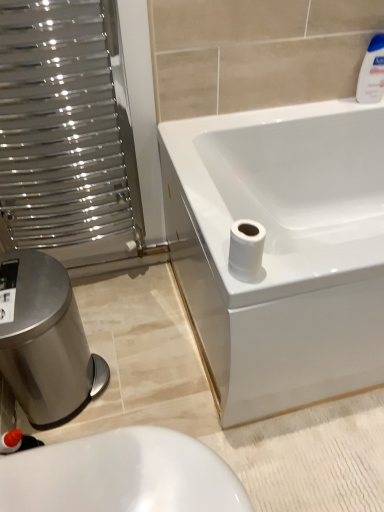
Question: Is white glossy toilet at lower left completely or partially inside white matte toilet paper at lower right?

Choices:
 (A) yes
 (B) no

Answer: (B)

Question: From a real-world perspective, is white matte toilet paper at lower right beneath white glossy toilet at lower left?

Choices:
 (A) no
 (B) yes

Answer: (A)

Question: From a real-world perspective, is white matte toilet paper at lower right located higher than white glossy toilet at lower left?

Choices:
 (A) yes
 (B) no

Answer: (A)

Question: Is white matte toilet paper at lower right wider than white glossy toilet at lower left?

Choices:
 (A) no
 (B) yes

Answer: (A)

Question: Considering the relative sizes of white matte toilet paper at lower right and white glossy toilet at lower left in the image provided, is white matte toilet paper at lower right thinner than white glossy toilet at lower left?

Choices:
 (A) yes
 (B) no

Answer: (A)

Question: Is white matte toilet paper at lower right positioned behind white glossy toilet at lower left?

Choices:
 (A) no
 (B) yes

Answer: (B)

Question: Does white glossy toilet at lower left have a smaller size compared to brushed metal bidet at lower left?

Choices:
 (A) yes
 (B) no

Answer: (A)

Question: From the image's perspective, is white glossy toilet at lower left located above brushed metal bidet at lower left?

Choices:
 (A) no
 (B) yes

Answer: (A)

Question: Considering the relative positions of white glossy toilet at lower left and brushed metal bidet at lower left in the image provided, is white glossy toilet at lower left behind brushed metal bidet at lower left?

Choices:
 (A) no
 (B) yes

Answer: (A)

Question: Is white glossy toilet at lower left to the left of brushed metal bidet at lower left from the viewer's perspective?

Choices:
 (A) no
 (B) yes

Answer: (A)

Question: Does white glossy toilet at lower left have a greater height compared to brushed metal bidet at lower left?

Choices:
 (A) yes
 (B) no

Answer: (B)

Question: Does white glossy toilet at lower left appear on the right side of brushed metal bidet at lower left?

Choices:
 (A) yes
 (B) no

Answer: (A)

Question: Considering the relative positions of metallic silver radiator at left and white matte toilet paper at lower right in the image provided, is metallic silver radiator at left to the left of white matte toilet paper at lower right from the viewer's perspective?

Choices:
 (A) no
 (B) yes

Answer: (B)